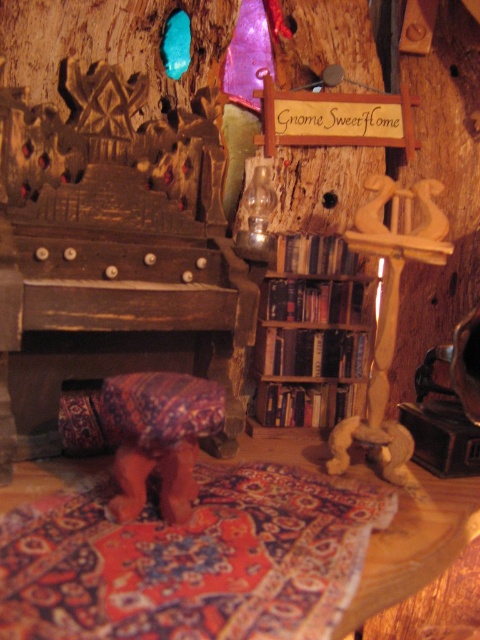
Can you confirm if woodenmaterial/texturebookshelf at center is taller than wooden candlestick at right?

In fact, woodenmaterial/texturebookshelf at center may be shorter than wooden candlestick at right.

Looking at this image, which of these two, woodenmaterial/texturebookshelf at center or wooden candlestick at right, stands shorter?

woodenmaterial/texturebookshelf at center is shorter.

Which is behind, point (320, 292) or point (384, 291)?

The point (320, 292) is more distant.

This screenshot has height=640, width=480. Identify the location of woodenmaterial/texturebookshelf at center. (312, 336).

Between patterned fabric stool at center and wooden candlestick at right, which one has less height?

Standing shorter between the two is patterned fabric stool at center.

Is patterned fabric stool at center above wooden candlestick at right?

Actually, patterned fabric stool at center is below wooden candlestick at right.

Measure the distance between point (x=222, y=388) and camera.

They are 1.53 meters apart.

What are the coordinates of `patterned fabric stool at center` in the screenshot? It's located at (158, 436).

Is woodenmaterial/texturebookshelf at center above patterned fabric stool at center?

Correct, woodenmaterial/texturebookshelf at center is located above patterned fabric stool at center.

Is point (307, 378) farther from camera compared to point (173, 512)?

Yes, point (307, 378) is behind point (173, 512).

Does point (338, 371) lie behind point (135, 497)?

Yes.

Locate an element on the screen. The width and height of the screenshot is (480, 640). woodenmaterial/texturebookshelf at center is located at coordinates coord(312,336).